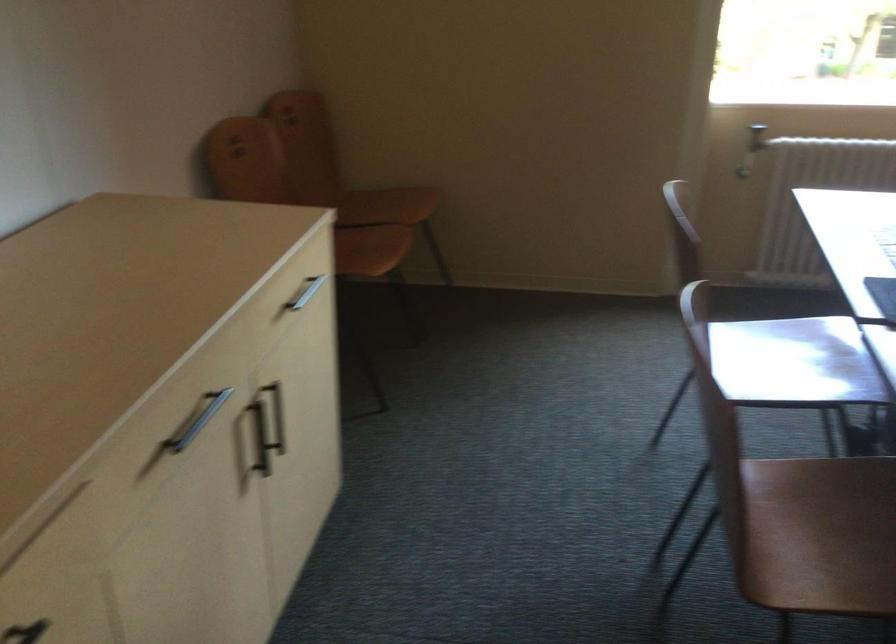
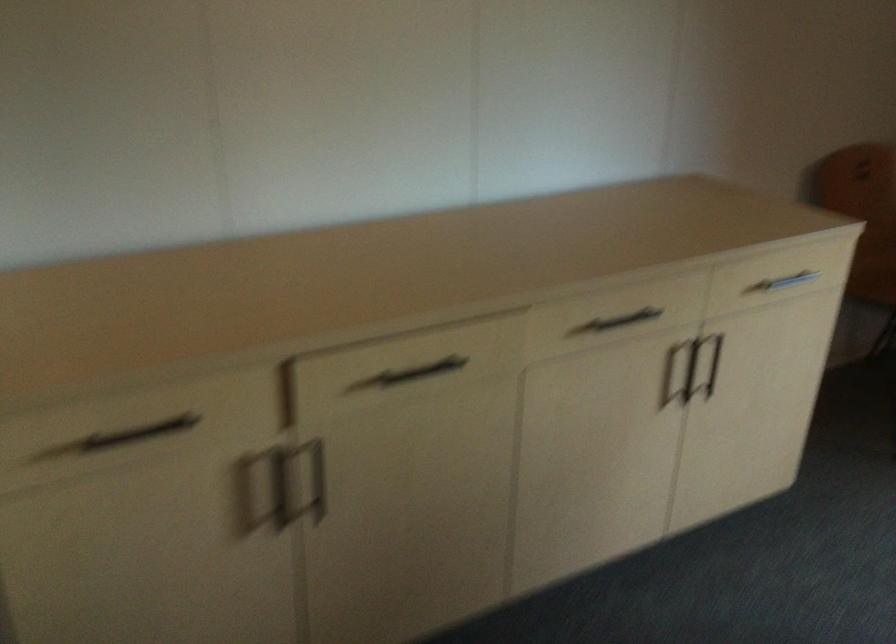
Question: The first image is from the beginning of the video and the second image is from the end. How did the camera likely rotate when shooting the video?

Choices:
 (A) Left
 (B) Right
 (C) Up
 (D) Down

Answer: (A)